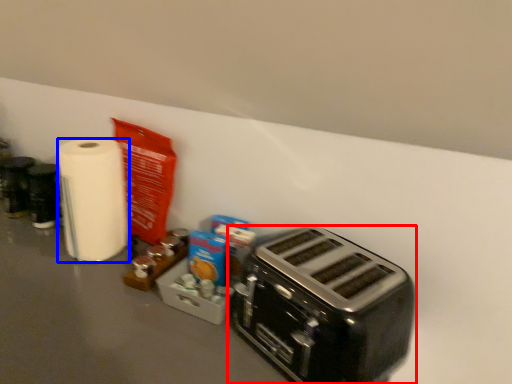
Question: Which object is further to the camera taking this photo, toaster (highlighted by a red box) or paper towel (highlighted by a blue box)?

Choices:
 (A) toaster
 (B) paper towel

Answer: (B)